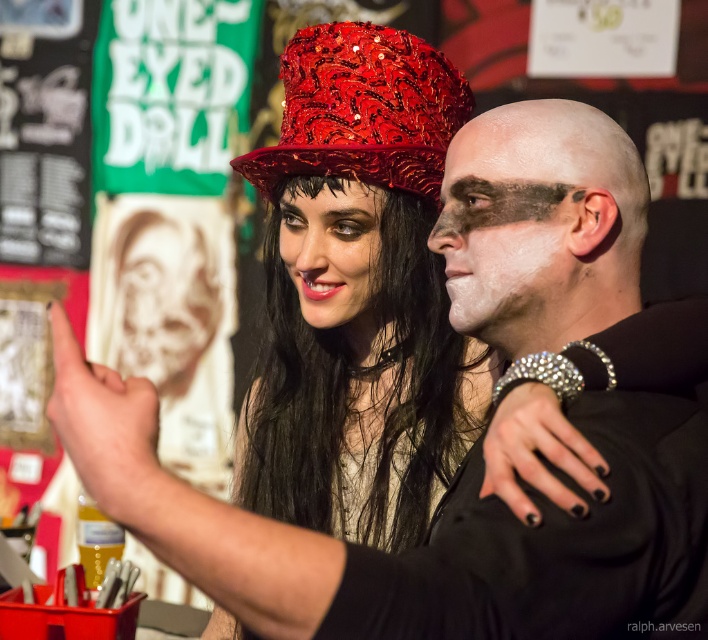
You are a photographer trying to capture the shiny sequined hat at center in your shot. The camera is positioned at point 0.5, 0.5. Can you adjust the camera to focus on the hat?

Yes, the shiny sequined hat at center is located at point (358, 294), which is very close to the camera position at (354, 320). The photographer can easily adjust the camera slightly to focus on the hat.

You are a photographer trying to adjust the lighting for a closeup shot of the two main subjects in the image. You need to ensure that both the shiny sequined hat at upper center and the white matte face at center are well lit. Based on their positions, which subject should you adjust the light towards first to avoid shadows?

Since the shiny sequined hat at upper center is to the left of the white matte face at center, you should adjust the light towards the shiny sequined hat at upper center first to avoid casting shadows on the white matte face at center.